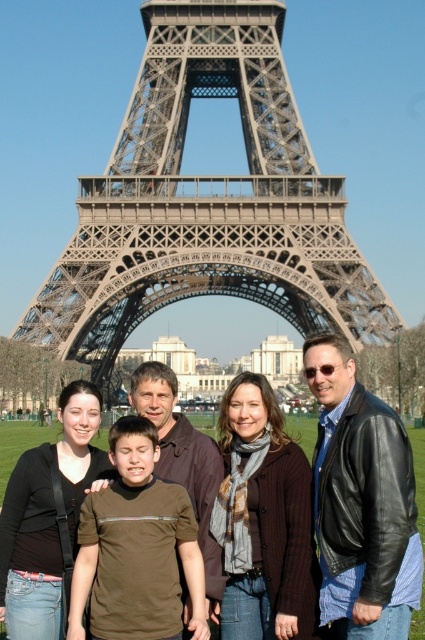
You are standing in front of the Eiffel Tower and see two points marked on the ground. The first point is labeled as point (59, 314) and the second point is labeled as point (393, 349). If you want to move from the first point to the second point, which direction should you walk relative to the Eiffel Tower?

You should walk away from the Eiffel Tower because point (59, 314) is in front of point (393, 349), meaning the second point is further back towards the tower.

You are taking a photo of the metallic gray eiffel tower at center and the brown casual shirt at center. Which object is positioned higher in the image?

The metallic gray eiffel tower at center is located above the brown casual shirt at center in the image.